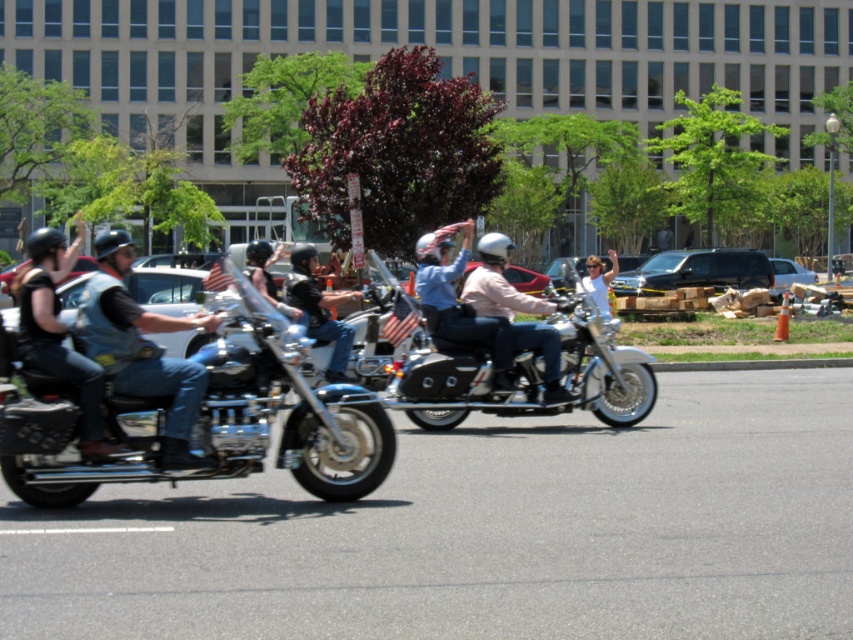
Question: Does matte pink jacket at center have a lesser width compared to white shirt at center?

Choices:
 (A) no
 (B) yes

Answer: (B)

Question: Does shiny chrome motorcycle at left have a larger size compared to white shirt at center?

Choices:
 (A) yes
 (B) no

Answer: (B)

Question: Which object is closer to the camera taking this photo?

Choices:
 (A) matte pink jacket at center
 (B) shiny chrome motorcycle at center
 (C) shiny chrome motorcycle at left
 (D) matte black helmet at center

Answer: (C)

Question: Among these points, which one is nearest to the camera?

Choices:
 (A) (288, 276)
 (B) (641, 356)
 (C) (548, 353)
 (D) (294, 328)

Answer: (C)

Question: Which of the following is the closest to the observer?

Choices:
 (A) (322, 312)
 (B) (26, 312)
 (C) (614, 266)

Answer: (B)

Question: Is matte pink jacket at center smaller than matte black helmet at center?

Choices:
 (A) yes
 (B) no

Answer: (B)